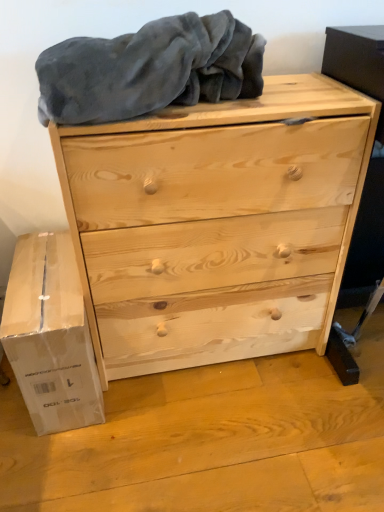
Find the location of a particular element. vacant area that lies in front of white cardboard box at lower left is located at coordinates (70, 463).